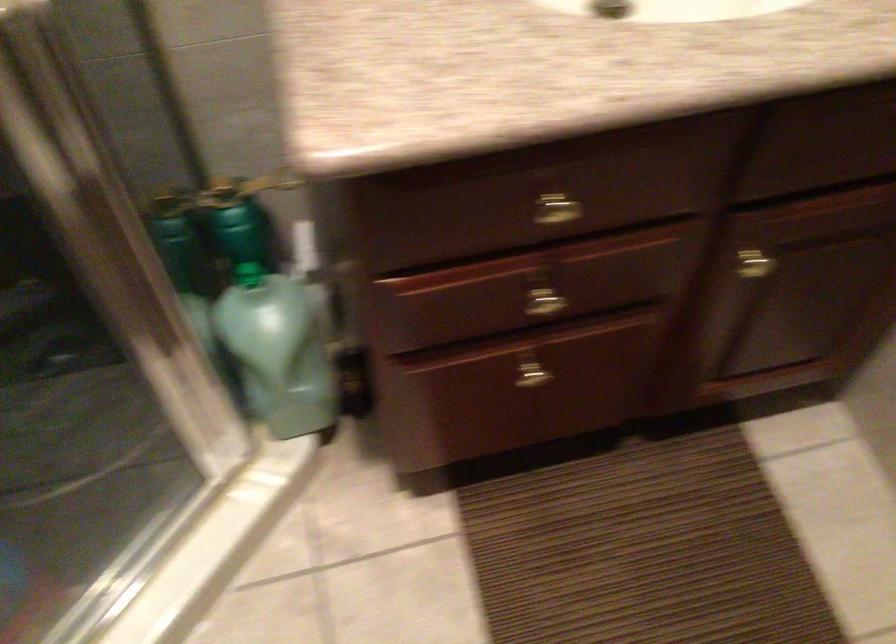
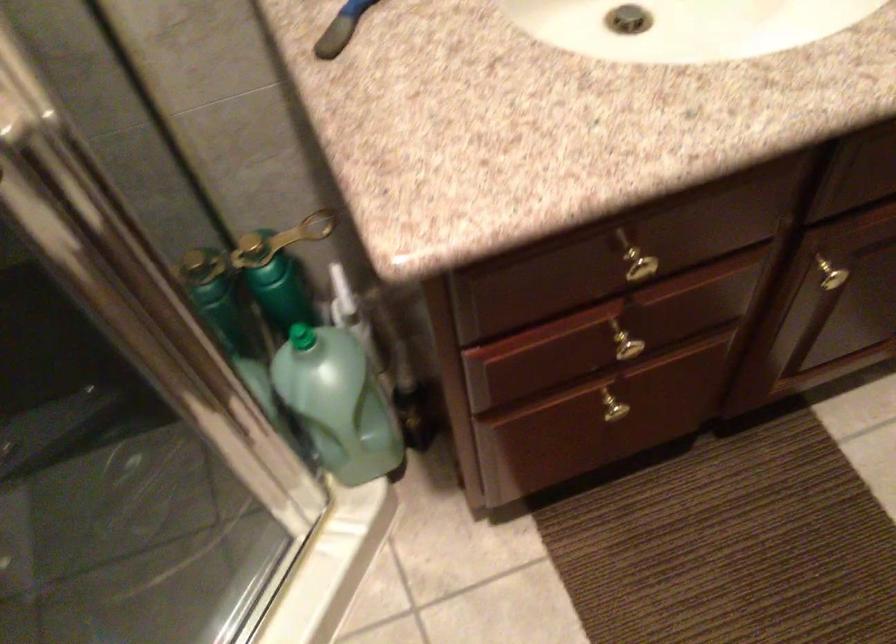
Find the pixel in the second image that matches pixel 540 303 in the first image.

(625, 346)